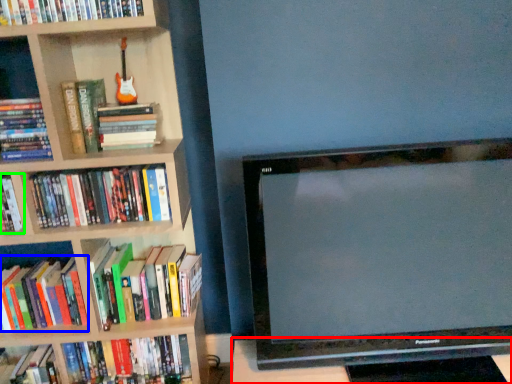
Question: Which object is the farthest from table (highlighted by a red box)? Choose among these: book (highlighted by a blue box) or book (highlighted by a green box).

Choices:
 (A) book
 (B) book

Answer: (B)